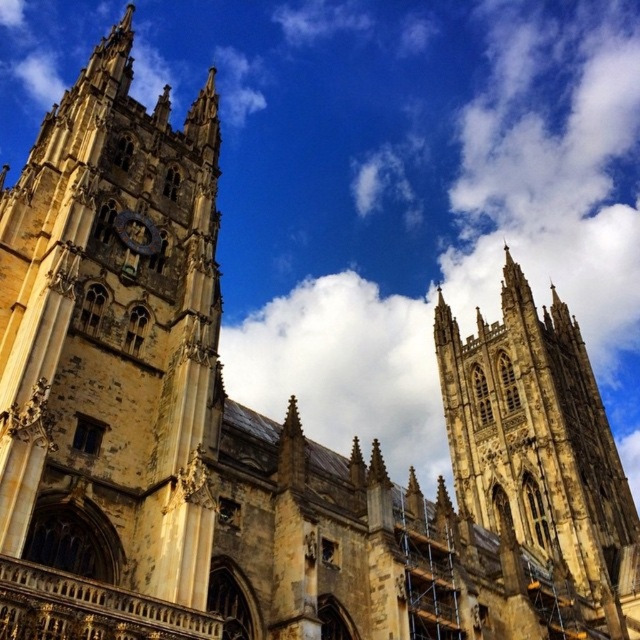
Which of these two, yellow stone tower at center or gold metallic clock at center, stands taller?

yellow stone tower at center

Which is behind, point (518, 522) or point (120, 221)?

The point (518, 522) is behind.

Who is more distant from viewer, [561,364] or [120,236]?

Positioned behind is point [561,364].

The height and width of the screenshot is (640, 640). In order to click on yellow stone tower at center in this screenshot , I will do `click(540, 449)`.

Can you confirm if yellow stone tower at left is positioned above yellow stone tower at center?

Yes.

Can you confirm if yellow stone tower at left is positioned below yellow stone tower at center?

Actually, yellow stone tower at left is above yellow stone tower at center.

Between point (36, 252) and point (532, 308), which one is positioned behind?

Positioned behind is point (532, 308).

Locate an element on the screen. This screenshot has width=640, height=640. yellow stone tower at left is located at coordinates (109, 365).

What do you see at coordinates (109, 365) in the screenshot? The height and width of the screenshot is (640, 640). I see `yellow stone tower at left` at bounding box center [109, 365].

Can you confirm if yellow stone tower at left is positioned to the right of gold metallic clock at center?

No, yellow stone tower at left is not to the right of gold metallic clock at center.

At what (x,y) coordinates should I click in order to perform the action: click on yellow stone tower at left. Please return your answer as a coordinate pair (x, y). The width and height of the screenshot is (640, 640). Looking at the image, I should click on (109, 365).

This screenshot has height=640, width=640. Identify the location of yellow stone tower at left. (109, 365).